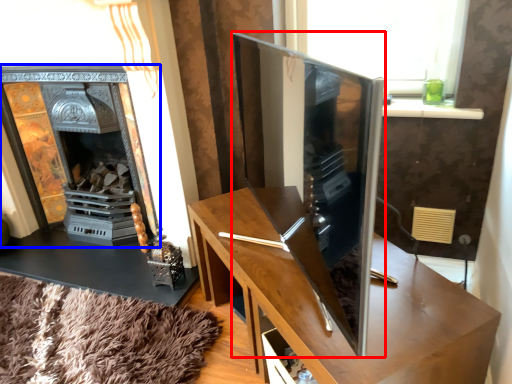
Question: Which of the following is the closest to the observer, tv cabinet (highlighted by a red box) or fireplace (highlighted by a blue box)?

Choices:
 (A) tv cabinet
 (B) fireplace

Answer: (A)